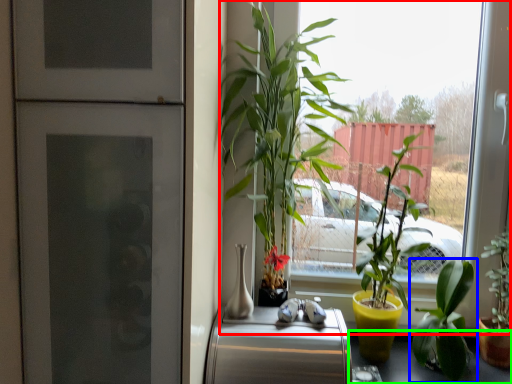
Question: Which is farther away from window (highlighted by a red box)? houseplant (highlighted by a blue box) or table (highlighted by a green box)?

Choices:
 (A) houseplant
 (B) table

Answer: (B)